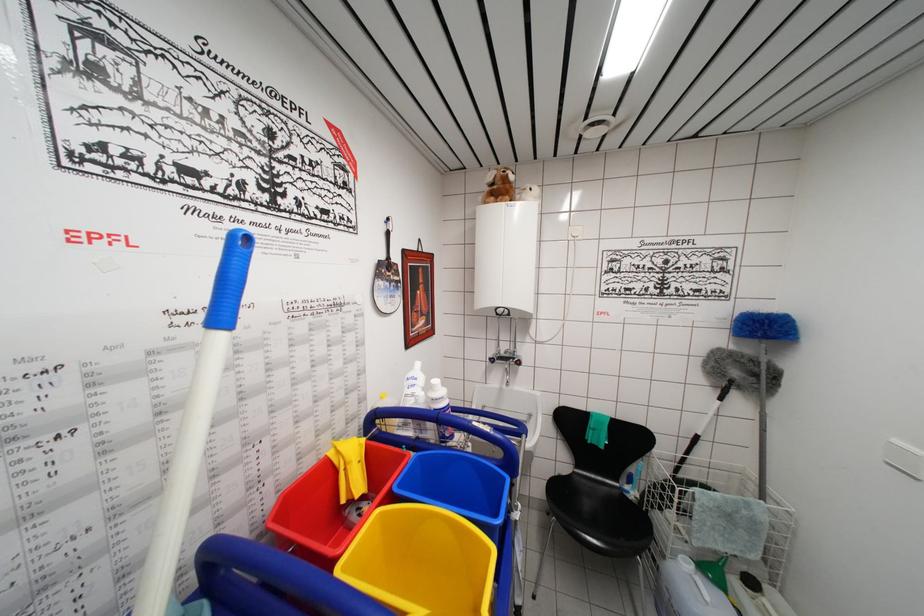
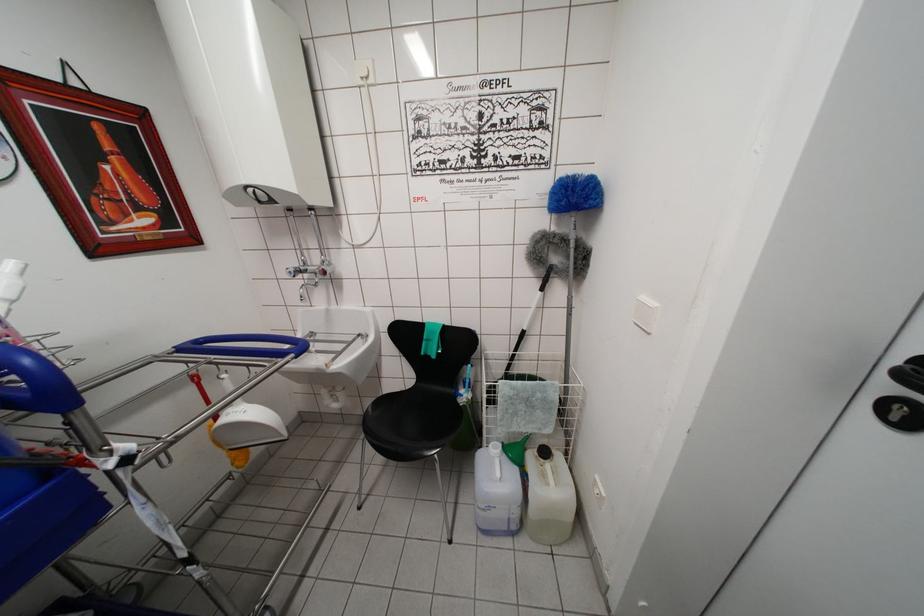
Locate, in the second image, the point that corresponds to [756,337] in the first image.

(562, 206)